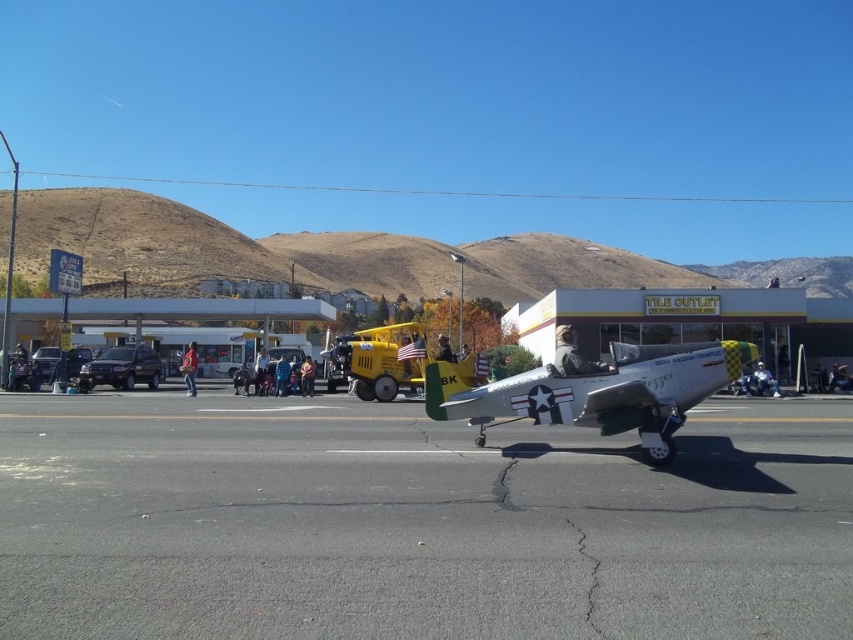
Question: Is gray asphalt at center to the right of silver metallic airplane at center from the viewer's perspective?

Choices:
 (A) yes
 (B) no

Answer: (B)

Question: Does gray asphalt at center appear on the left side of silver metallic airplane at center?

Choices:
 (A) no
 (B) yes

Answer: (B)

Question: Is gray asphalt at center above silver metallic airplane at center?

Choices:
 (A) no
 (B) yes

Answer: (A)

Question: Which point is closer to the camera?

Choices:
 (A) silver metallic airplane at center
 (B) gray asphalt at center

Answer: (B)

Question: Among these points, which one is nearest to the camera?

Choices:
 (A) (671, 433)
 (B) (351, 596)

Answer: (B)